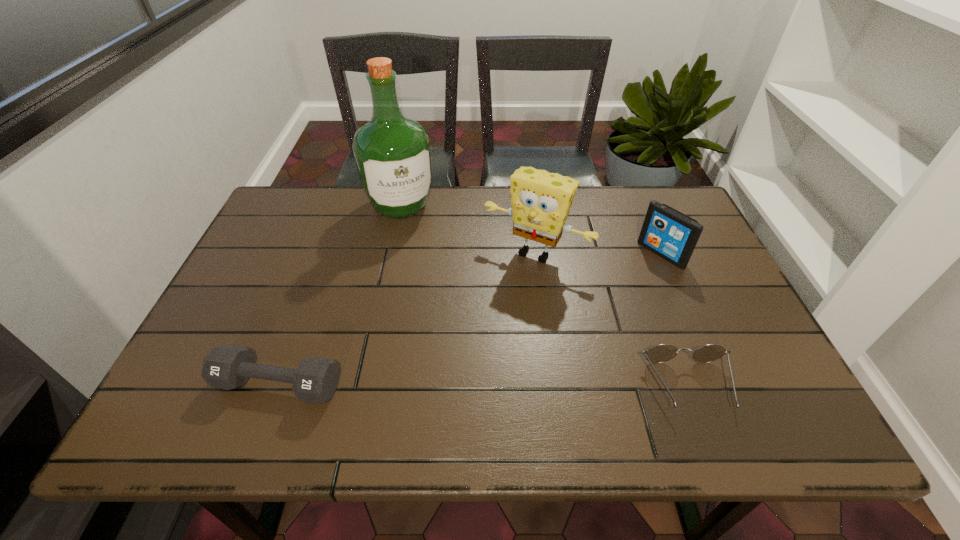
You are a GUI agent. You are given a task and a screenshot of the screen. Output one action in this format:
    pyautogui.click(x=<x>, y=<y>)
    Task: Click on the vacant space on the desktop that is between the dumbbell and the shortest object and is positioned on the face of the third object from right to left
    This screenshot has height=540, width=960.
    Given the screenshot: What is the action you would take?
    pyautogui.click(x=452, y=385)

This screenshot has width=960, height=540. In order to click on free space on the desktop that is between the second shortest object and the shortest object and is positioned on the front-facing side of the farthest object in this screenshot , I will do `click(479, 385)`.

Identify the location of vacant space on the desktop that is between the second shortest object and the spectacles and is positioned on the front screen of the iPod. (484, 385).